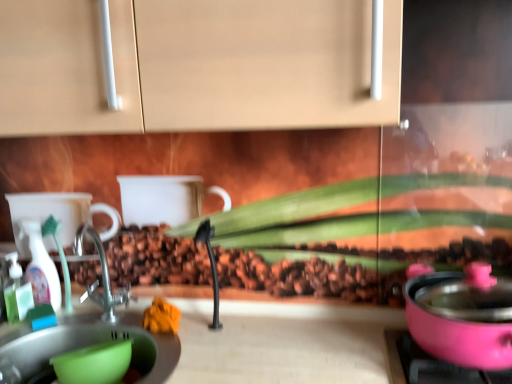
Question: Is translucent plastic spray bottle at left to the left or to the right of green plastic bowl at lower left in the image?

Choices:
 (A) left
 (B) right

Answer: (A)

Question: In terms of size, does translucent plastic spray bottle at left appear bigger or smaller than green plastic bowl at lower left?

Choices:
 (A) big
 (B) small

Answer: (B)

Question: In terms of width, does translucent plastic spray bottle at left look wider or thinner when compared to green plastic bowl at lower left?

Choices:
 (A) thin
 (B) wide

Answer: (A)

Question: Considering their positions, is green plastic bowl at lower left located in front of or behind translucent plastic spray bottle at left?

Choices:
 (A) behind
 (B) front

Answer: (B)

Question: Looking at the image, does green plastic bowl at lower left seem bigger or smaller compared to translucent plastic spray bottle at left?

Choices:
 (A) small
 (B) big

Answer: (B)

Question: From the image's perspective, is green plastic bowl at lower left positioned above or below translucent plastic spray bottle at left?

Choices:
 (A) below
 (B) above

Answer: (A)

Question: From their relative heights in the image, would you say green plastic bowl at lower left is taller or shorter than translucent plastic spray bottle at left?

Choices:
 (A) short
 (B) tall

Answer: (A)